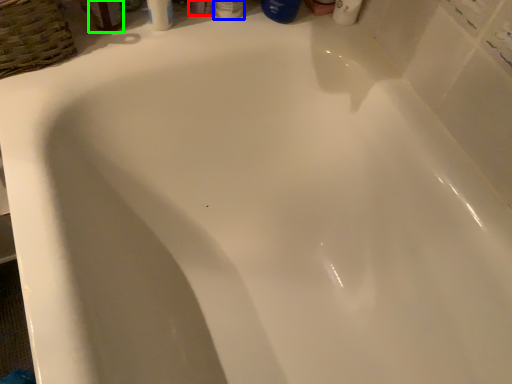
Question: Based on their relative distances, which object is nearer to toiletry (highlighted by a red box)? Choose from toiletry (highlighted by a blue box) and mouthwash (highlighted by a green box).

Choices:
 (A) toiletry
 (B) mouthwash

Answer: (A)